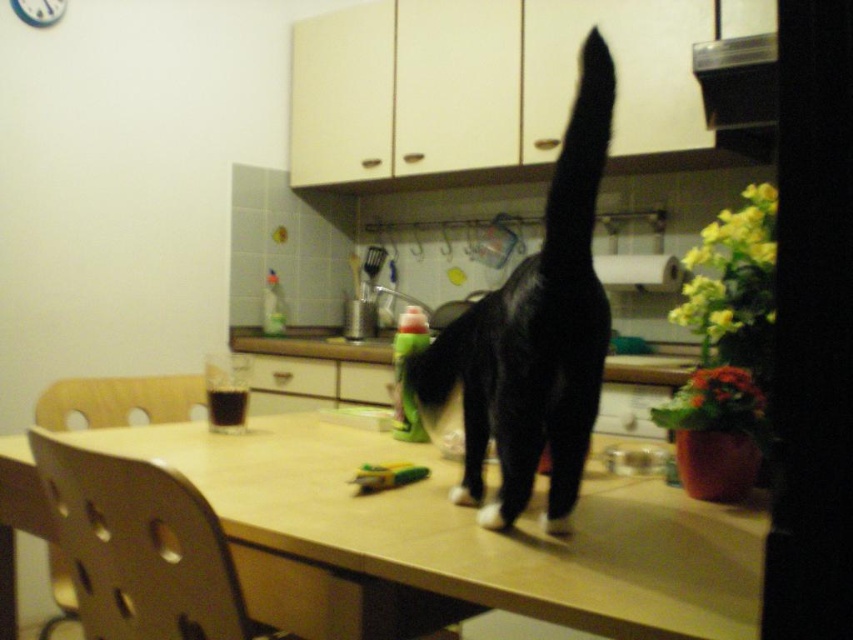
You are a chef preparing to place a new ingredient on the light brown wooden table at center and the black fur cat at center. Which object should you avoid placing items on?

You should avoid placing items on the black fur cat at center because the light brown wooden table at center is positioned on the left side of it, meaning the cat is on the right side and likely not a stable surface for placing items.

You are holding a 20 inch long ruler and want to measure the distance from the camera to the light brown wooden table at center. Can your ruler reach the table?

The light brown wooden table at center is 23.01 inches away from the camera. Since the ruler is only 20 inches long, it cannot fully reach the table.

Where is the black fur cat at center located in the image?

The black fur cat at center is located at point coordinates of (534, 333).